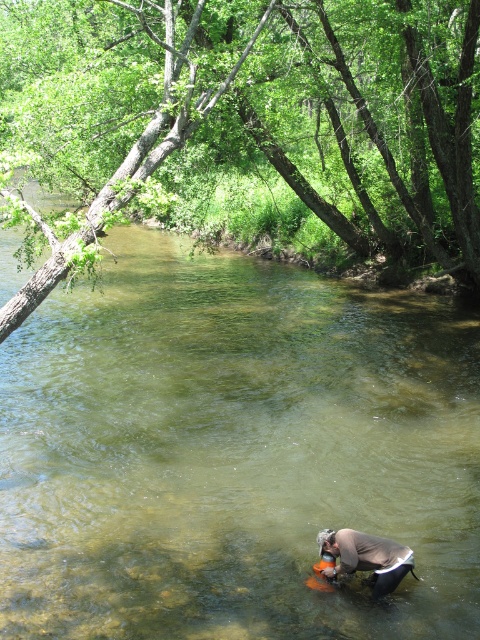
Describe the element at coordinates (232, 451) in the screenshot. I see `clear water at center` at that location.

Is clear water at center shorter than light brown fabric at lower center?

No.

This screenshot has height=640, width=480. I want to click on clear water at center, so click(x=232, y=451).

Which of these two, clear water at center or green leafy tree at upper left, stands taller?

green leafy tree at upper left

Is point (19, 401) closer to viewer compared to point (228, 3)?

Yes, point (19, 401) is closer to viewer.

What are the coordinates of `clear water at center` in the screenshot? It's located at (232, 451).

Is green leafy tree at upper left to the left of light brown fabric at lower center from the viewer's perspective?

Indeed, green leafy tree at upper left is positioned on the left side of light brown fabric at lower center.

Can you confirm if green leafy tree at upper left is wider than light brown fabric at lower center?

Yes, green leafy tree at upper left is wider than light brown fabric at lower center.

Who is more forward, (336, 237) or (403, 568)?

Point (403, 568)

The image size is (480, 640). I want to click on green leafy tree at upper left, so [x=243, y=129].